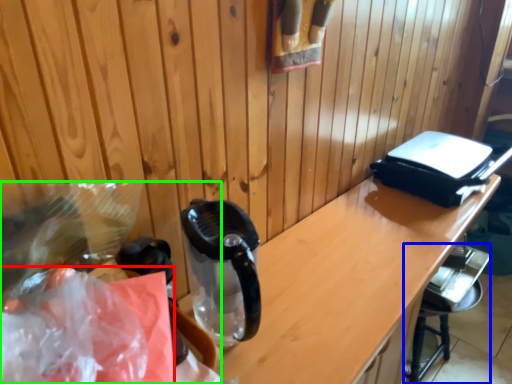
Question: Which is nearer to the plastic bag (highlighted by a red box)? bar stool (highlighted by a blue box) or waste (highlighted by a green box).

Choices:
 (A) bar stool
 (B) waste

Answer: (B)